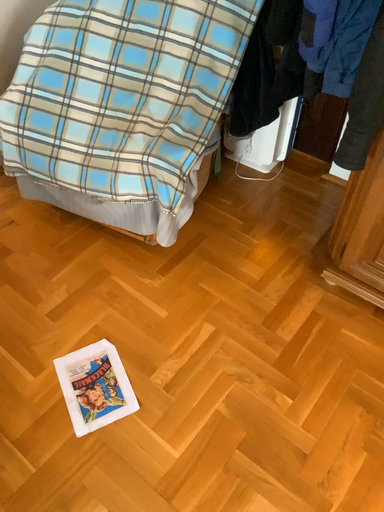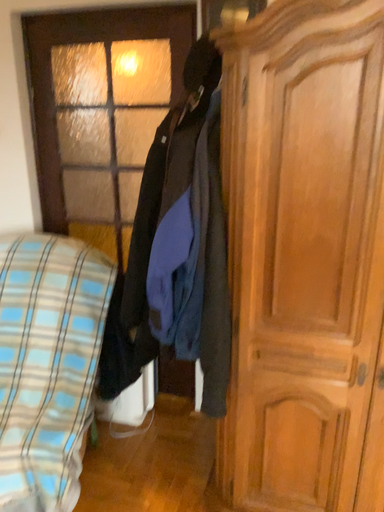
Question: Which way did the camera rotate in the video?

Choices:
 (A) rotated left
 (B) rotated right

Answer: (B)